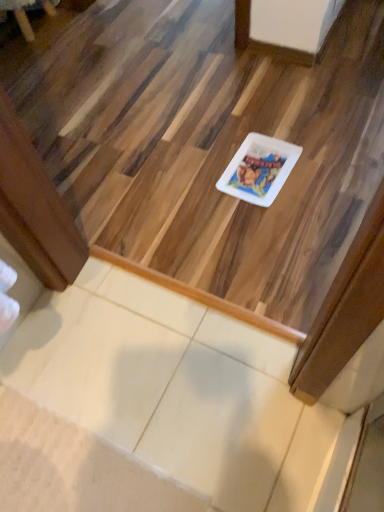
Find the location of a particular element. free space on the front side of white glossy plate at center is located at coordinates (280, 223).